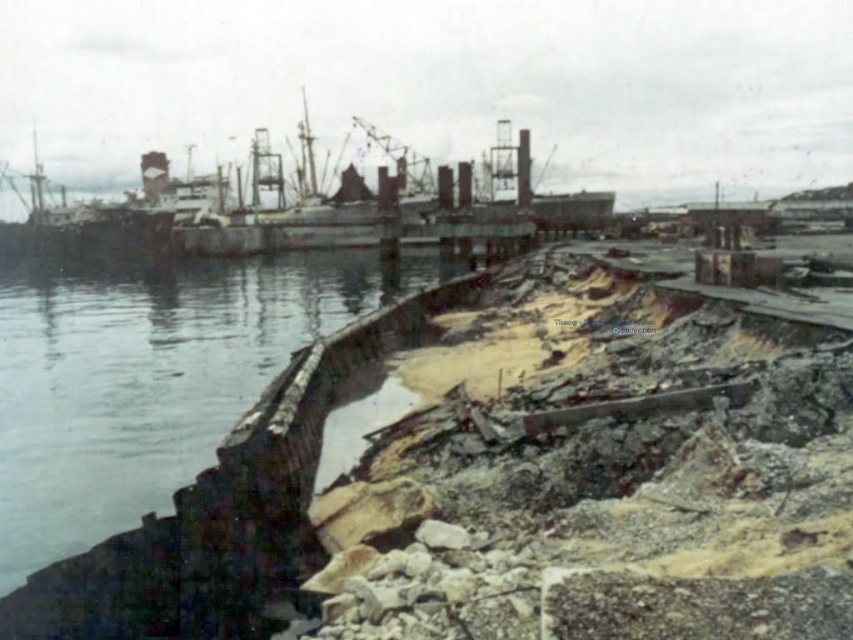
Does rusty metallic water at lower left lie behind rusty metal ship at center?

That is False.

Measure the distance between point (231,298) and camera.

Point (231,298) and camera are 71.75 meters apart.

What do you see at coordinates (142, 385) in the screenshot? This screenshot has height=640, width=853. I see `rusty metallic water at lower left` at bounding box center [142, 385].

Where is `rusty metallic water at lower left`? rusty metallic water at lower left is located at coordinates (142, 385).